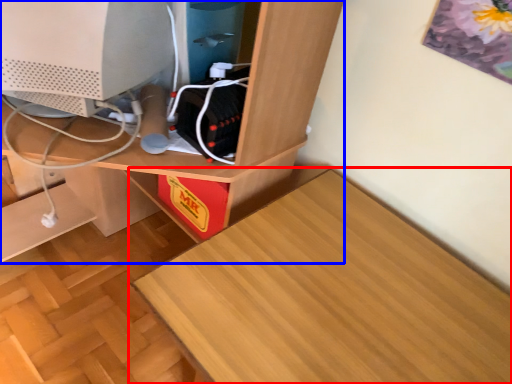
Question: Which object is further to the camera taking this photo, table (highlighted by a red box) or desk (highlighted by a blue box)?

Choices:
 (A) table
 (B) desk

Answer: (A)